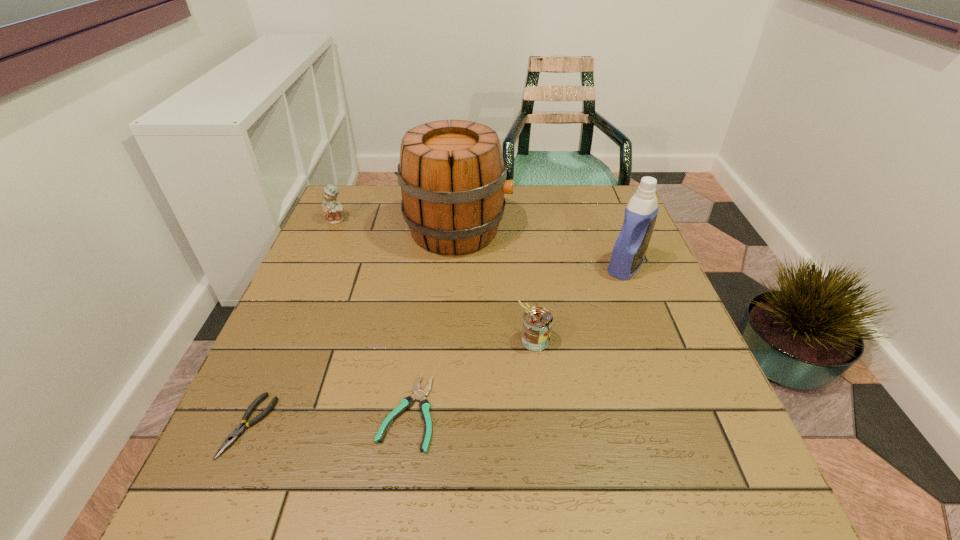
The height and width of the screenshot is (540, 960). Find the location of `vacant point located between the teddy bear and the taller pliers`. vacant point located between the teddy bear and the taller pliers is located at coordinates (293, 323).

This screenshot has height=540, width=960. I want to click on vacant area between the right pliers and the can, so click(471, 376).

Locate an element on the screen. free point between the rightmost object and the cider is located at coordinates (541, 248).

Identify the location of empty space between the teddy bear and the right pliers. (372, 316).

Locate an element on the screen. free spot between the can and the cider is located at coordinates (496, 285).

The height and width of the screenshot is (540, 960). I want to click on empty location between the teddy bear and the shortest object, so coord(372,316).

This screenshot has width=960, height=540. Identify the location of vacant space that's between the can and the cider. (496, 285).

Where is `object identified as the second closest to the detergent`? Image resolution: width=960 pixels, height=540 pixels. object identified as the second closest to the detergent is located at coordinates (453, 177).

Select which object is the third closest to the teddy bear. Please provide its 2D coordinates. Your answer should be formatted as a tuple, i.e. [(x, y)], where the tuple contains the x and y coordinates of a point satisfying the conditions above.

[(239, 430)]

Where is `free location that satisfies the following two spatial constraints: 1. on the front-facing side of the teddy bear; 2. on the right side of the taller pliers`? Image resolution: width=960 pixels, height=540 pixels. free location that satisfies the following two spatial constraints: 1. on the front-facing side of the teddy bear; 2. on the right side of the taller pliers is located at coordinates (247, 426).